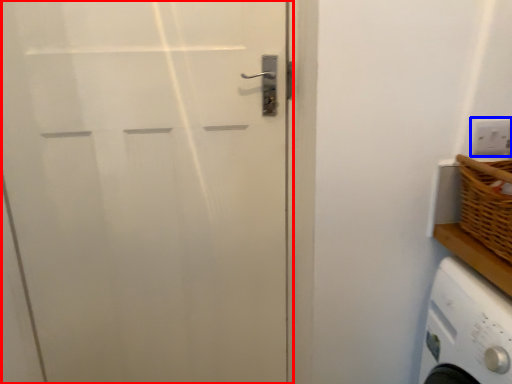
Question: Which object is closer to the camera taking this photo, door (highlighted by a red box) or electric outlet (highlighted by a blue box)?

Choices:
 (A) door
 (B) electric outlet

Answer: (A)